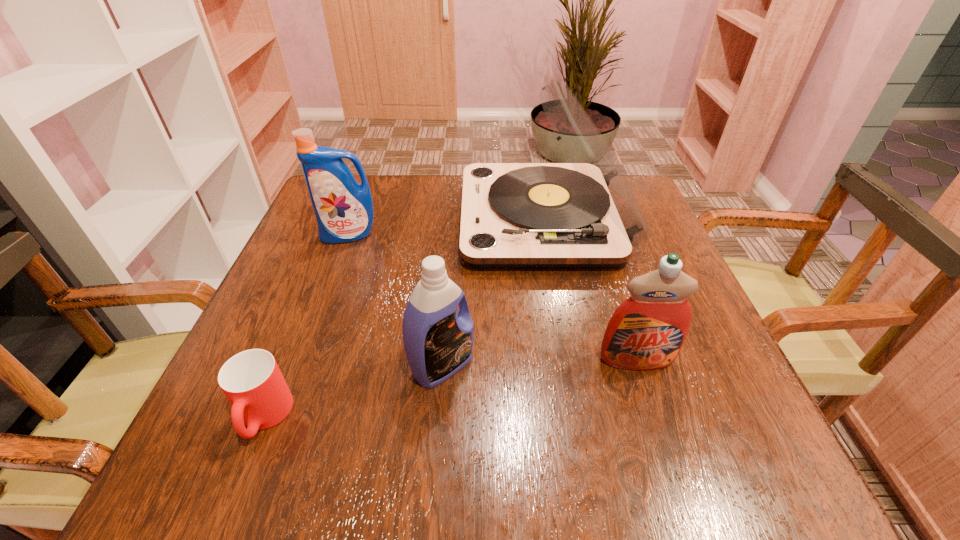
Locate an element on the screen. empty space that is in between the rightmost detergent and the leftmost detergent is located at coordinates (492, 297).

This screenshot has width=960, height=540. I want to click on vacant area that lies between the rightmost detergent and the tallest object, so click(x=590, y=289).

This screenshot has width=960, height=540. I want to click on the fourth closest object relative to the rightmost detergent, so click(344, 211).

Locate which object is the fourth closest to the leftmost detergent. Please provide its 2D coordinates. Your answer should be formatted as a tuple, i.e. [(x, y)], where the tuple contains the x and y coordinates of a point satisfying the conditions above.

[(646, 332)]

Image resolution: width=960 pixels, height=540 pixels. Identify the location of detergent that is the second nearest to the second detergent from right to left. (344, 211).

You are a GUI agent. You are given a task and a screenshot of the screen. Output one action in this format:
    pyautogui.click(x=<x>, y=<y>)
    Task: Click on the detergent that stands as the second closest to the leftmost detergent
    
    Given the screenshot: What is the action you would take?
    pyautogui.click(x=646, y=332)

Find the location of a particular element. This screenshot has height=540, width=960. free space that satisfies the following two spatial constraints: 1. with the tonearm facing the front of the record player; 2. on the side of the cup with the handle is located at coordinates (581, 417).

Find the location of `free region that satisfies the following two spatial constraints: 1. on the label of the second detergent from left to right; 2. on the left side of the leftmost detergent`. free region that satisfies the following two spatial constraints: 1. on the label of the second detergent from left to right; 2. on the left side of the leftmost detergent is located at coordinates (300, 366).

The width and height of the screenshot is (960, 540). What are the coordinates of `free spot that satisfies the following two spatial constraints: 1. with the tonearm facing the front of the tallest object; 2. on the side of the shortest object with the handle` in the screenshot? It's located at (581, 417).

I want to click on vacant area in the image that satisfies the following two spatial constraints: 1. with the tonearm facing the front of the record player; 2. on the label of the leftmost detergent, so click(x=546, y=235).